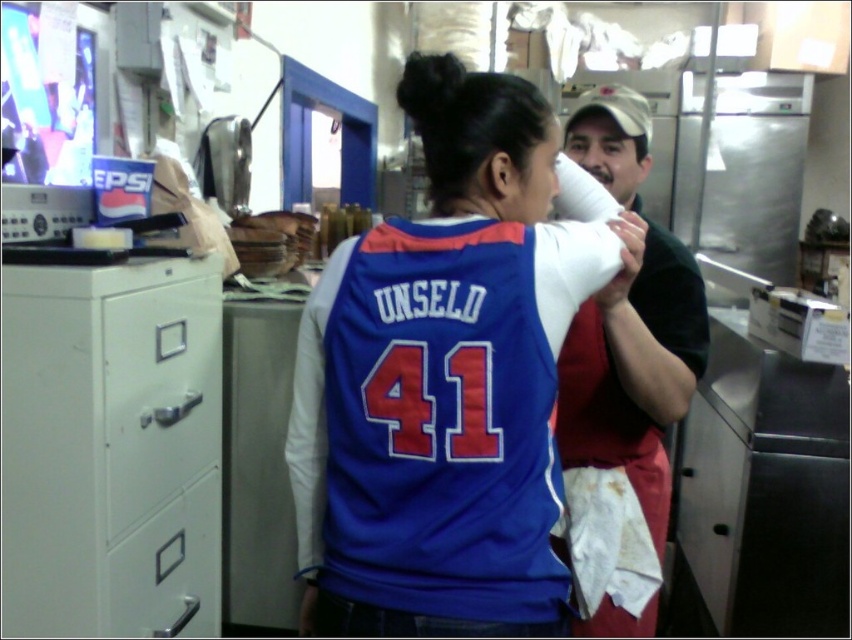
Question: Does white matte/file cabinet at left appear under metallic gray drawer at lower left?

Choices:
 (A) no
 (B) yes

Answer: (A)

Question: Which point is farther from the camera taking this photo?

Choices:
 (A) (645, 128)
 (B) (383, 484)
 (C) (145, 582)
 (D) (150, 465)

Answer: (A)

Question: Which object is farther from the camera taking this photo?

Choices:
 (A) metallic gray drawer at lower left
 (B) matte black shirt at center

Answer: (B)

Question: Is metallic gray file cabinet at left to the right of metallic gray drawer at lower left from the viewer's perspective?

Choices:
 (A) no
 (B) yes

Answer: (B)

Question: Does metallic gray file cabinet at left have a smaller size compared to metallic gray drawer at lower left?

Choices:
 (A) yes
 (B) no

Answer: (B)

Question: Which point appears closest to the camera in this image?

Choices:
 (A) coord(13,566)
 (B) coord(309,582)
 (C) coord(154,336)

Answer: (A)